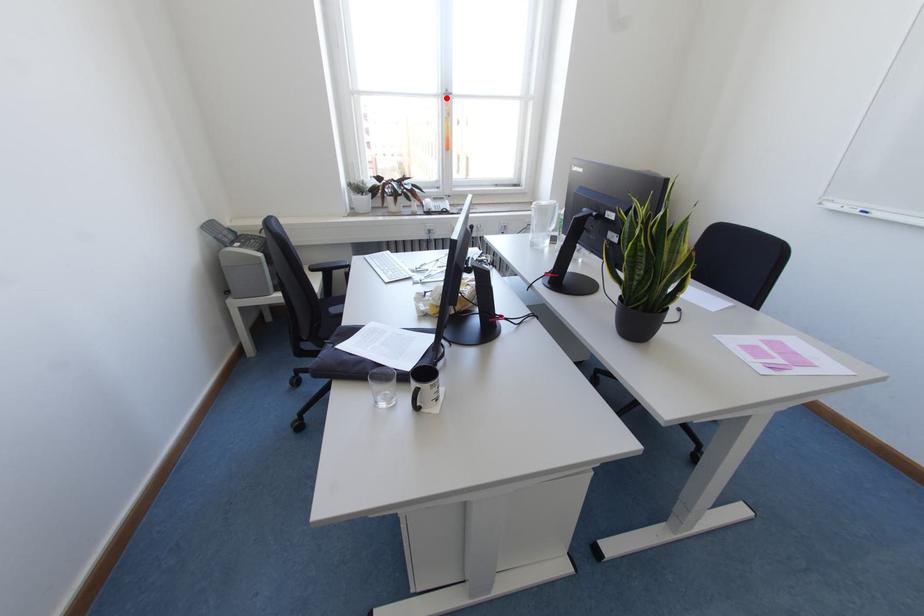
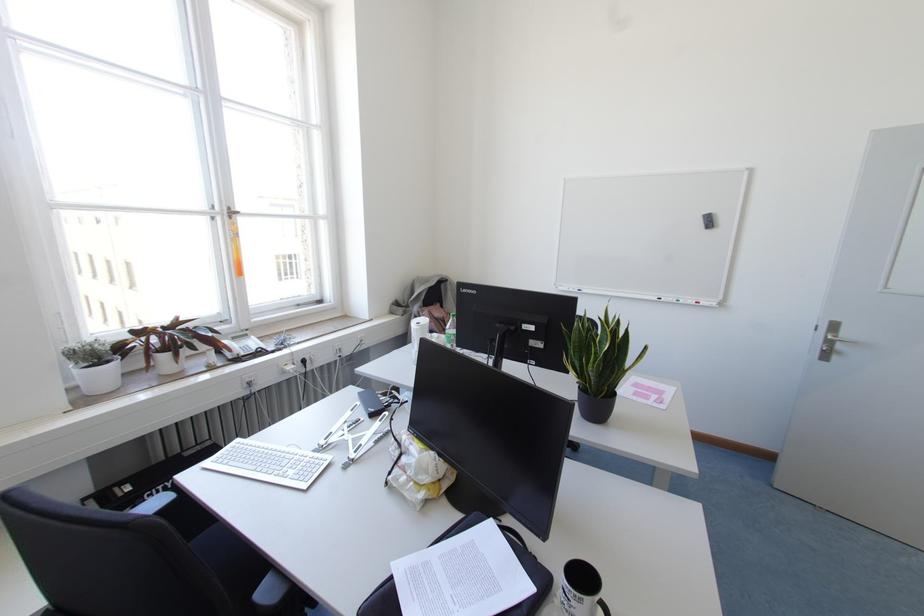
Question: A red point is marked in image1. In image2, is the corresponding 3D point closer to the camera or farther? Reply with the corresponding letter.

Choices:
 (A) The corresponding 3D point is closer.
 (B) The corresponding 3D point is farther.

Answer: (B)